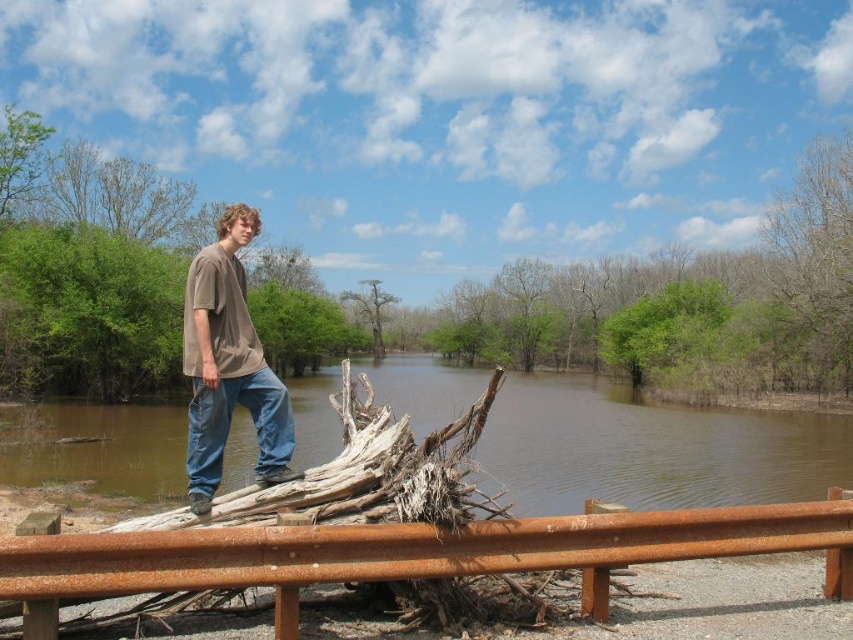
Between brown cotton shirt at center and green leafy tree at upper left, which one appears on the left side from the viewer's perspective?

green leafy tree at upper left is more to the left.

Is point (201, 472) positioned after point (15, 179)?

No, it is in front of (15, 179).

I want to click on brown cotton shirt at center, so pos(228,365).

Does brown wood tree at center have a greater height compared to brown cotton shirt at center?

Yes.

Is brown wood tree at center wider than brown cotton shirt at center?

Correct, the width of brown wood tree at center exceeds that of brown cotton shirt at center.

Is point (90, 154) positioned in front of point (225, 381)?

That is False.

Locate an element on the screen. The height and width of the screenshot is (640, 853). brown wood tree at center is located at coordinates (676, 304).

Between rusty metal rail at lower center and bare wood tree at upper right, which one appears on the right side from the viewer's perspective?

bare wood tree at upper right

Is point (53, 589) behind point (836, 289)?

That is False.

What do you see at coordinates (410, 554) in the screenshot?
I see `rusty metal rail at lower center` at bounding box center [410, 554].

Locate an element on the screen. The width and height of the screenshot is (853, 640). rusty metal rail at lower center is located at coordinates (410, 554).